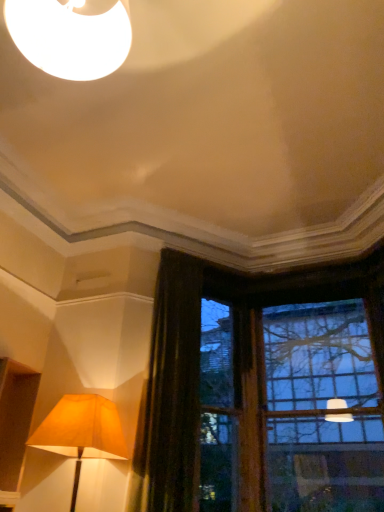
Question: Considering their positions, is clear glass window at upper right located in front of or behind dark brown velvet curtain at left?

Choices:
 (A) behind
 (B) front

Answer: (A)

Question: In terms of size, does clear glass window at upper right appear bigger or smaller than dark brown velvet curtain at left?

Choices:
 (A) big
 (B) small

Answer: (A)

Question: Which of these objects is positioned farthest from the dark brown velvet curtain at left?

Choices:
 (A) matte gold lampshade at lower left
 (B) clear glass window at upper right

Answer: (A)

Question: Estimate the real-world distances between objects in this image. Which object is closer to the dark brown velvet curtain at left?

Choices:
 (A) clear glass window at upper right
 (B) matte gold lampshade at lower left

Answer: (A)